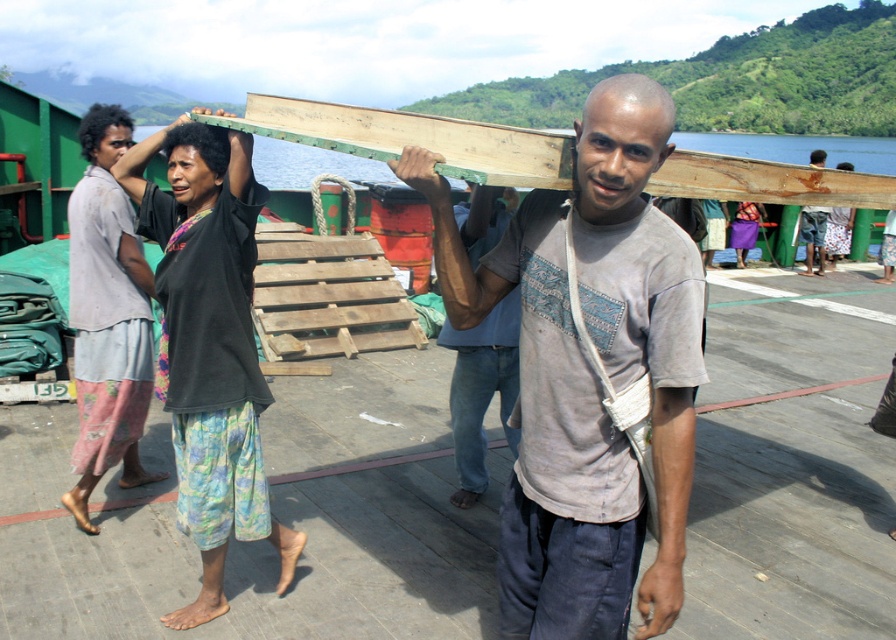
Question: Which of the following is the closest to the observer?

Choices:
 (A) (812, 221)
 (B) (472, 396)
 (C) (606, 596)
 (D) (178, 364)

Answer: (C)

Question: Is matte gray shirt at center thinner than wooden plank at upper center?

Choices:
 (A) yes
 (B) no

Answer: (B)

Question: Is black cotton shirt at upper center bigger than wooden plank at upper center?

Choices:
 (A) no
 (B) yes

Answer: (B)

Question: Which point is farther to the camera?

Choices:
 (A) (820, 264)
 (B) (452, 339)

Answer: (A)

Question: Can you confirm if matte gray shirt at center is positioned to the left of wooden plank at upper center?

Choices:
 (A) no
 (B) yes

Answer: (B)

Question: Based on their relative distances, which object is farther from the matte gray shirt at center?

Choices:
 (A) black cotton shirt at upper center
 (B) gray cotton shirt at center
 (C) wooden plank at upper center

Answer: (C)